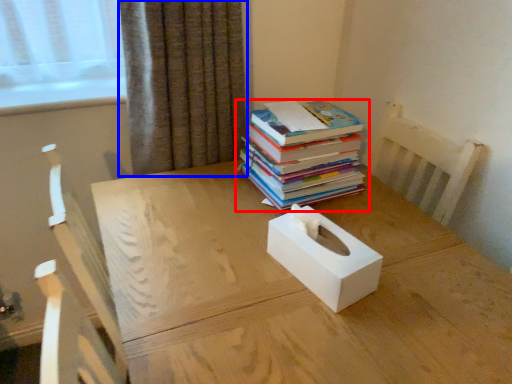
Question: Among these objects, which one is farthest to the camera, book (highlighted by a red box) or curtain (highlighted by a blue box)?

Choices:
 (A) book
 (B) curtain

Answer: (B)